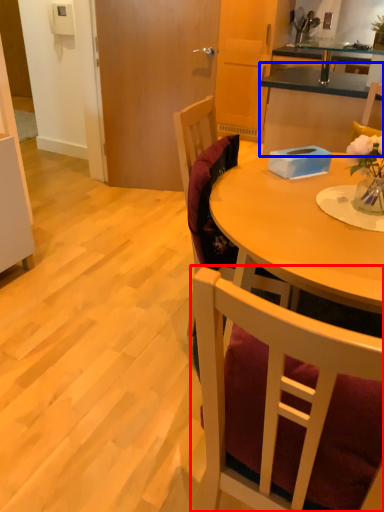
Question: Which object is further to the camera taking this photo, chair (highlighted by a red box) or cabinetry (highlighted by a blue box)?

Choices:
 (A) chair
 (B) cabinetry

Answer: (B)